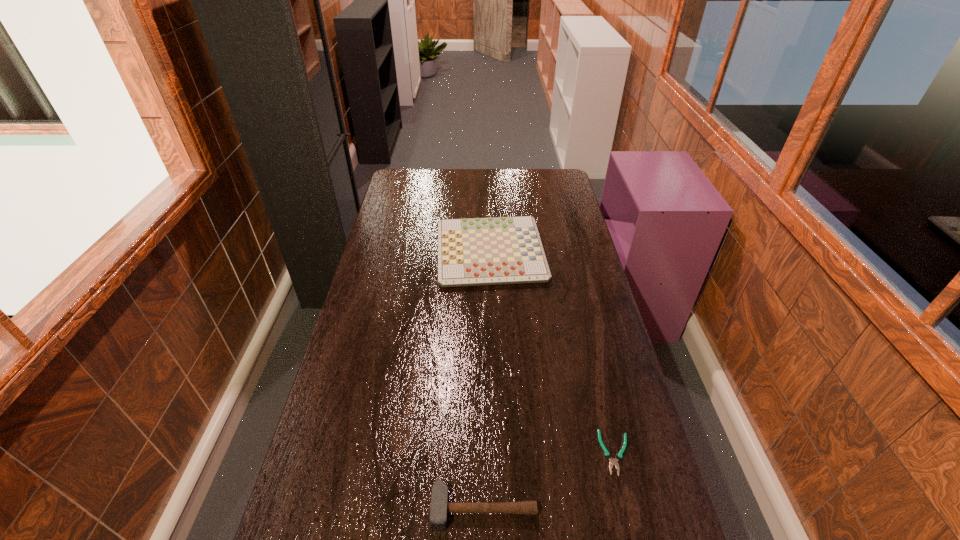
Find the location of a particular element. This screenshot has height=540, width=960. the farthest object is located at coordinates (496, 250).

This screenshot has width=960, height=540. I want to click on hammer, so click(x=439, y=507).

The image size is (960, 540). Identify the location of the second farthest object. point(613,461).

The height and width of the screenshot is (540, 960). Identify the location of the rightmost object. (613, 461).

Locate an element on the screen. The width and height of the screenshot is (960, 540). vacant area located 0.340m on the front of the gameboard is located at coordinates (493, 366).

Locate an element on the screen. The width and height of the screenshot is (960, 540). vacant space located 0.170m on the left of the shortest object is located at coordinates (536, 453).

At what (x,y) coordinates should I click in order to perform the action: click on object that is at the right edge. Please return your answer as a coordinate pair (x, y). The width and height of the screenshot is (960, 540). Looking at the image, I should click on (613, 461).

Find the location of a particular element. vacant space at the far edge of the desktop is located at coordinates tap(505, 191).

I want to click on vacant space at the left edge of the desktop, so pyautogui.click(x=356, y=339).

In the image, there is a desktop. Where is `free space at the right edge`? free space at the right edge is located at coordinates 636,422.